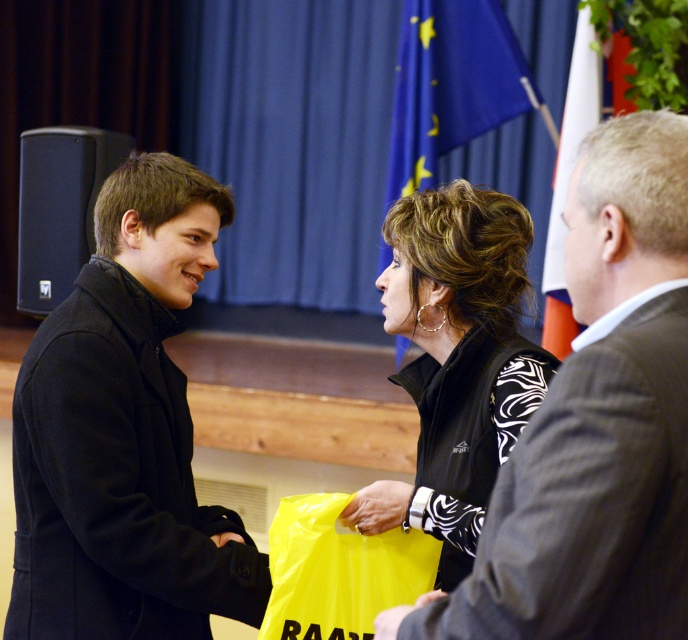
Question: Can you confirm if blue fabric flag at upper center is positioned above yellow plastic bag at center?

Choices:
 (A) yes
 (B) no

Answer: (A)

Question: Among these objects, which one is farthest from the camera?

Choices:
 (A) black wool coat at center
 (B) black zebra-patterned jacket at center
 (C) white fabric flag at right

Answer: (C)

Question: Among these points, which one is nearest to the camera?

Choices:
 (A) (424, 212)
 (B) (131, 467)
 (C) (451, 92)

Answer: (B)

Question: Does black zebra-patterned jacket at center appear over white fabric flag at right?

Choices:
 (A) yes
 (B) no

Answer: (B)

Question: Does matte black suit at center have a larger size compared to black wool coat at center?

Choices:
 (A) yes
 (B) no

Answer: (B)

Question: Among these objects, which one is farthest from the camera?

Choices:
 (A) blue fabric flag at upper center
 (B) yellow plastic bag at center

Answer: (A)